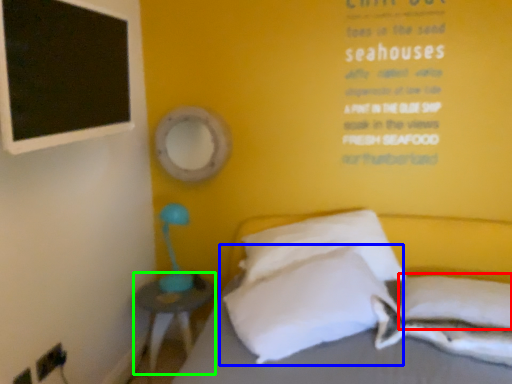
Question: Estimate the real-world distances between objects in this image. Which object is farther from pillow (highlighted by a red box), pillow (highlighted by a blue box) or nightstand (highlighted by a green box)?

Choices:
 (A) pillow
 (B) nightstand

Answer: (B)